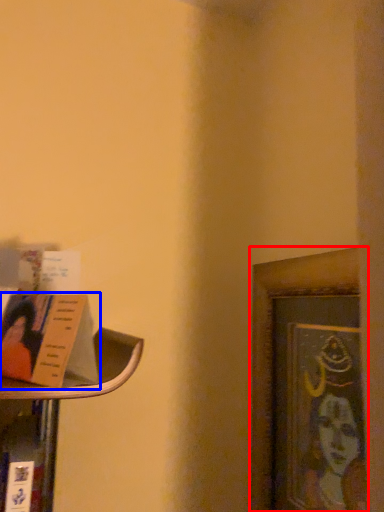
Question: Which point is further to the camera, picture frame (highlighted by a red box) or book (highlighted by a blue box)?

Choices:
 (A) picture frame
 (B) book

Answer: (A)